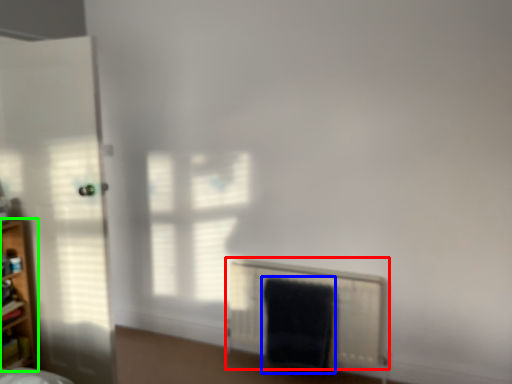
Question: Which object is positioned farthest from radiator (highlighted by a red box)? Select from bath towel (highlighted by a blue box) and shelf (highlighted by a green box).

Choices:
 (A) bath towel
 (B) shelf

Answer: (B)